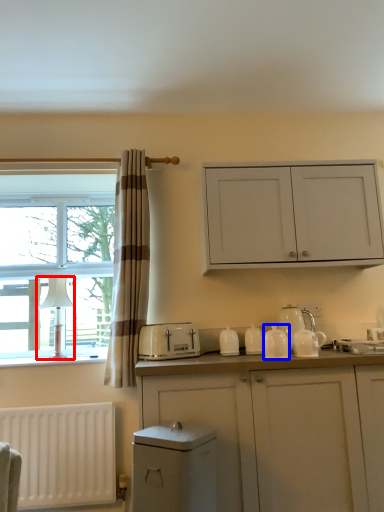
Question: Among these objects, which one is farthest to the camera, lamp (highlighted by a red box) or tableware (highlighted by a blue box)?

Choices:
 (A) lamp
 (B) tableware

Answer: (A)